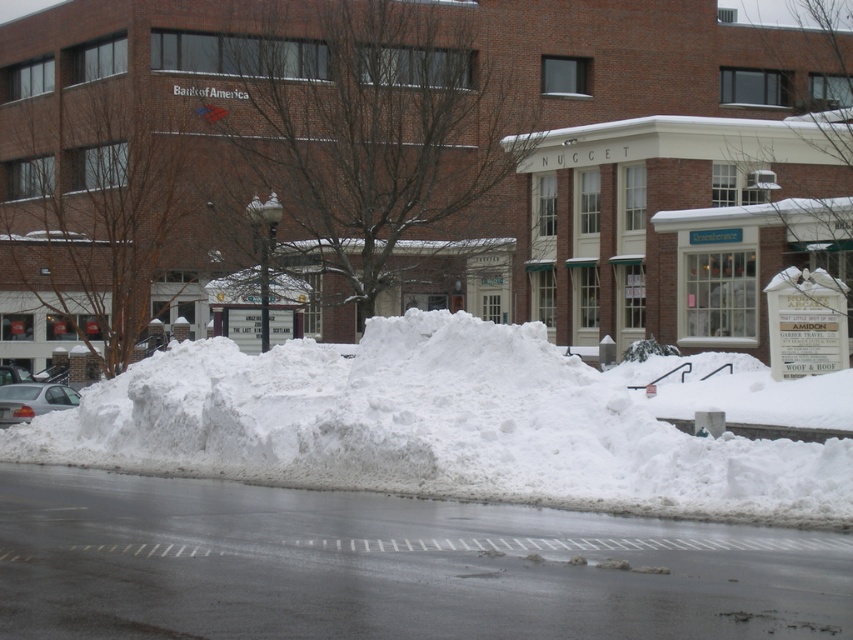
Based on the photo, between white fluffy snow at center and silver metallic sedan at lower left, which one has less height?

Standing shorter between the two is silver metallic sedan at lower left.

Is white fluffy snow at center closer to camera compared to silver metallic sedan at lower left?

Yes, it is.

This screenshot has width=853, height=640. What are the coordinates of `white fluffy snow at center` in the screenshot? It's located at (431, 426).